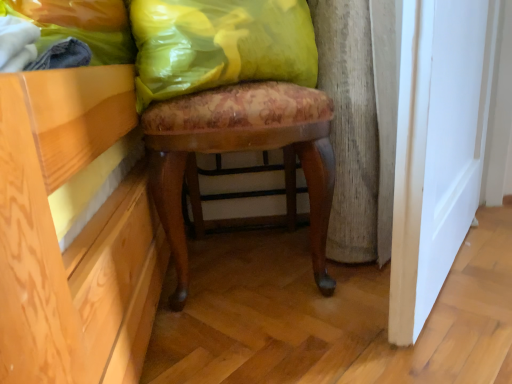
Question: From a real-world perspective, is yellow fabric pillow at upper center physically above yellow plastic bag at upper left?

Choices:
 (A) no
 (B) yes

Answer: (A)

Question: Can you see yellow fabric pillow at upper center touching yellow plastic bag at upper left?

Choices:
 (A) yes
 (B) no

Answer: (B)

Question: Can you confirm if yellow fabric pillow at upper center is shorter than yellow plastic bag at upper left?

Choices:
 (A) no
 (B) yes

Answer: (B)

Question: Considering the relative sizes of yellow fabric pillow at upper center and yellow plastic bag at upper left in the image provided, is yellow fabric pillow at upper center taller than yellow plastic bag at upper left?

Choices:
 (A) yes
 (B) no

Answer: (B)

Question: Would you say yellow fabric pillow at upper center is a long distance from yellow plastic bag at upper left?

Choices:
 (A) no
 (B) yes

Answer: (A)

Question: Considering the positions of yellow fabric pillow at upper center and floral fabric stool at center in the image, is yellow fabric pillow at upper center wider or thinner than floral fabric stool at center?

Choices:
 (A) wide
 (B) thin

Answer: (B)

Question: From a real-world perspective, is yellow fabric pillow at upper center positioned above or below floral fabric stool at center?

Choices:
 (A) above
 (B) below

Answer: (A)

Question: From the image's perspective, is yellow fabric pillow at upper center positioned above or below floral fabric stool at center?

Choices:
 (A) above
 (B) below

Answer: (A)

Question: Is yellow fabric pillow at upper center bigger or smaller than floral fabric stool at center?

Choices:
 (A) small
 (B) big

Answer: (A)

Question: Considering the relative positions of yellow plastic bag at upper left and yellow fabric pillow at upper center in the image provided, is yellow plastic bag at upper left to the left or to the right of yellow fabric pillow at upper center?

Choices:
 (A) left
 (B) right

Answer: (A)

Question: In terms of width, does yellow plastic bag at upper left look wider or thinner when compared to yellow fabric pillow at upper center?

Choices:
 (A) thin
 (B) wide

Answer: (A)

Question: Which is correct: yellow plastic bag at upper left is inside yellow fabric pillow at upper center, or outside of it?

Choices:
 (A) outside
 (B) inside

Answer: (A)

Question: Does point (51, 59) appear closer or farther from the camera than point (157, 57)?

Choices:
 (A) farther
 (B) closer

Answer: (B)

Question: Would you say yellow fabric pillow at upper center is inside or outside yellow plastic bag at upper left?

Choices:
 (A) inside
 (B) outside

Answer: (B)

Question: From the image's perspective, is yellow fabric pillow at upper center positioned above or below yellow plastic bag at upper left?

Choices:
 (A) below
 (B) above

Answer: (B)